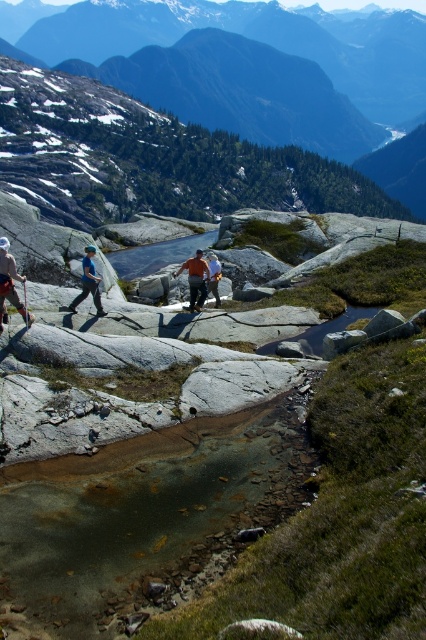
Question: Does blue fabric pants at center appear under brown leather jacket at center?

Choices:
 (A) no
 (B) yes

Answer: (B)

Question: Which of the following is the closest to the observer?

Choices:
 (A) matte blue jacket at left
 (B) green grassy mountain at upper center
 (C) blue fabric pants at center

Answer: (A)

Question: Does green grassy mountain at upper center have a smaller size compared to matte blue jacket at left?

Choices:
 (A) yes
 (B) no

Answer: (B)

Question: Which object is closer to the camera taking this photo?

Choices:
 (A) matte blue jacket at left
 (B) brown leather jacket at center
 (C) orange shirt at center

Answer: (A)

Question: Does green grassy mountain at upper center appear under blue fabric pants at center?

Choices:
 (A) yes
 (B) no

Answer: (B)

Question: Considering the real-world distances, which object is farthest from the brown leather jacket at center?

Choices:
 (A) blue fabric pants at center
 (B) matte blue jacket at left
 (C) green grassy mountain at upper center
 (D) orange shirt at center

Answer: (C)